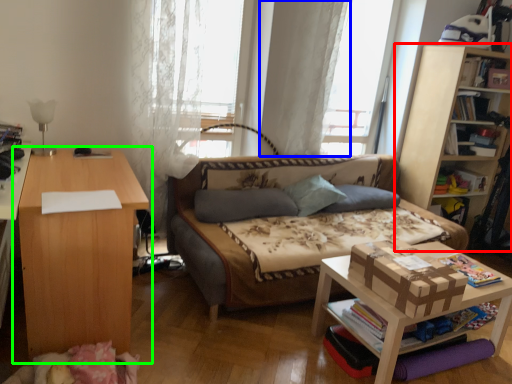
Question: Based on their relative distances, which object is nearer to bookcase (highlighted by a red box)? Choose from curtain (highlighted by a blue box) and table (highlighted by a green box).

Choices:
 (A) curtain
 (B) table

Answer: (A)